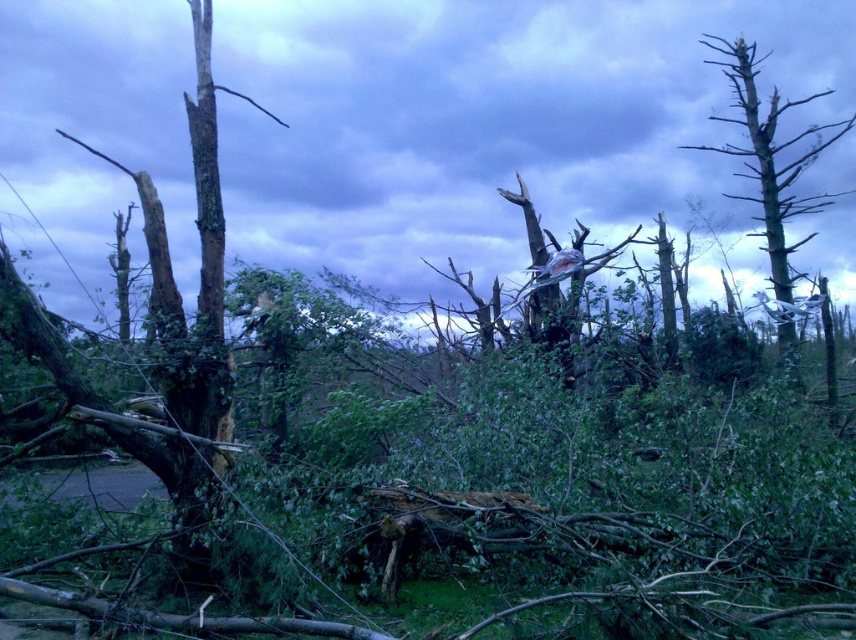
Question: In this image, where is dead wood debris at center located relative to bare wood tree at right?

Choices:
 (A) above
 (B) below

Answer: (A)

Question: In this image, where is dead wood debris at center located relative to bare wood tree at right?

Choices:
 (A) right
 (B) left

Answer: (B)

Question: Does dead wood debris at center lie behind bare wood tree at right?

Choices:
 (A) no
 (B) yes

Answer: (A)

Question: Which of the following is the farthest from the observer?

Choices:
 (A) bare wood tree at right
 (B) dead wood debris at center

Answer: (A)

Question: Which point is farther from the camera taking this photo?

Choices:
 (A) (848, 125)
 (B) (354, 163)

Answer: (B)